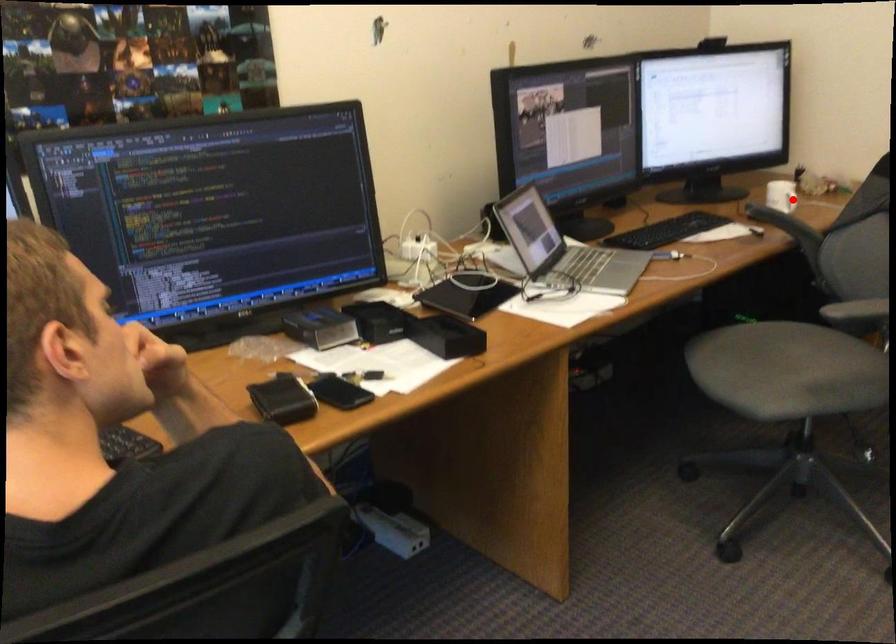
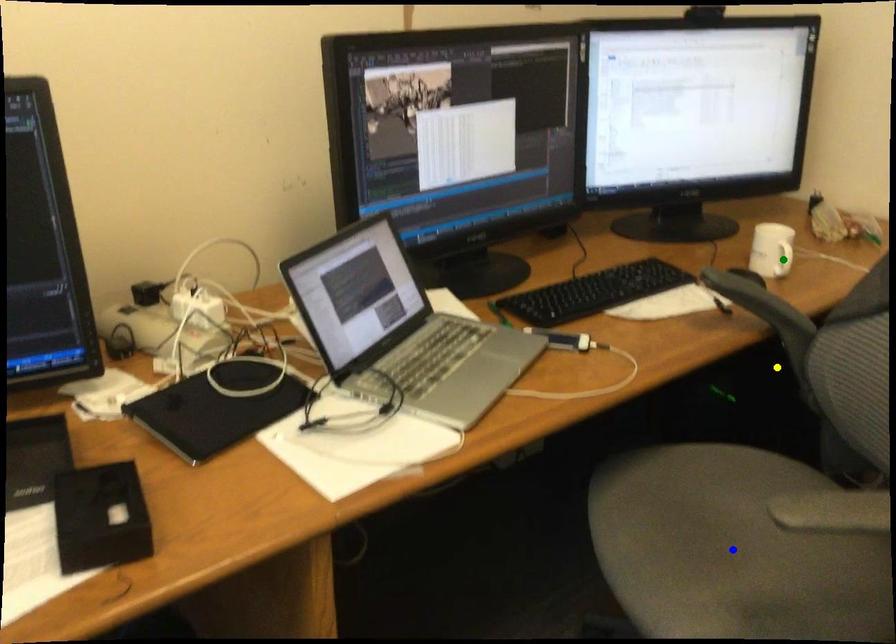
Question: I am providing you with two images of the same scene from different viewpoints. A red point is marked on the first image. You are given multiple points on the second image. Which spot in image 2 lines up with the point in image 1?

Choices:
 (A) green point
 (B) blue point
 (C) yellow point

Answer: (A)